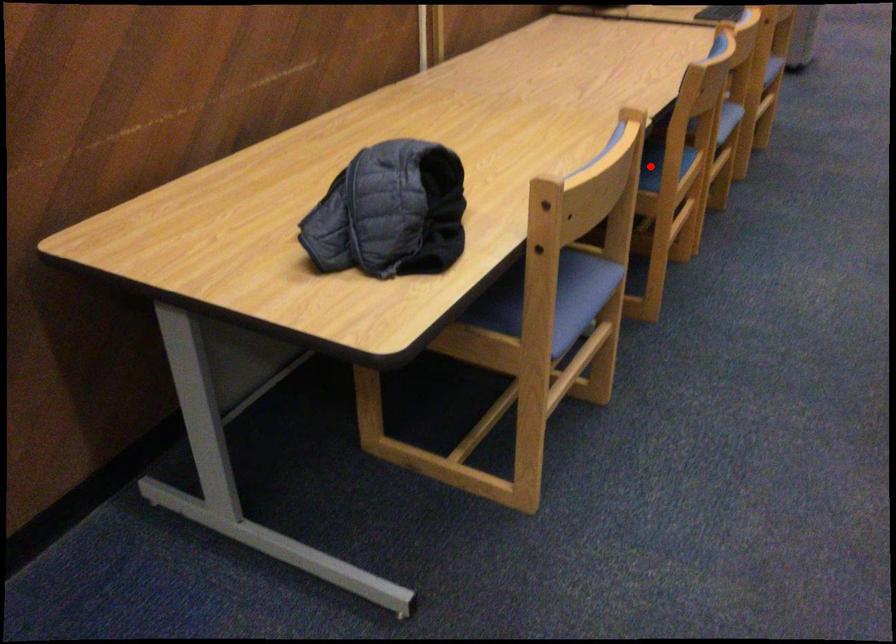
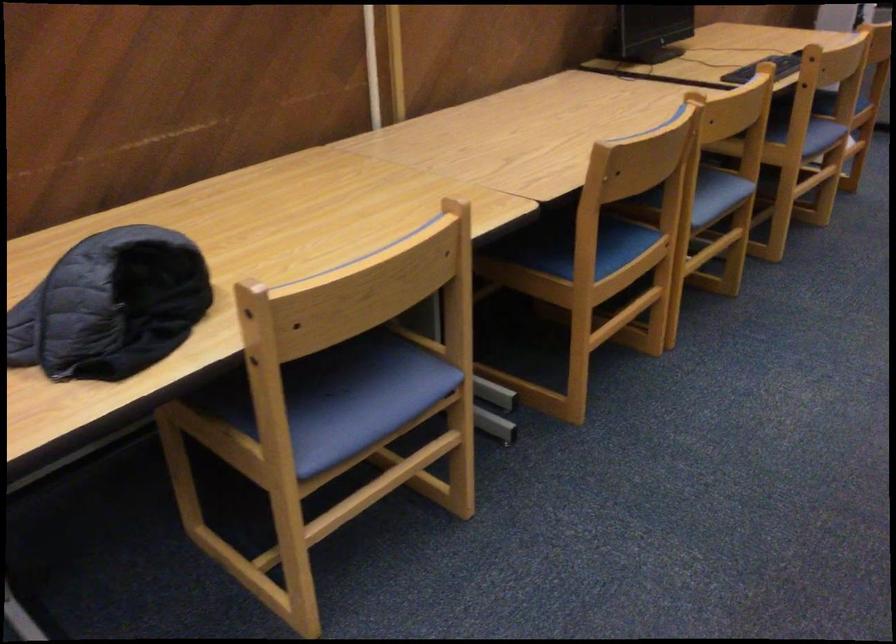
Where in the second image is the point corresponding to the highlighted location from the first image?

(597, 248)